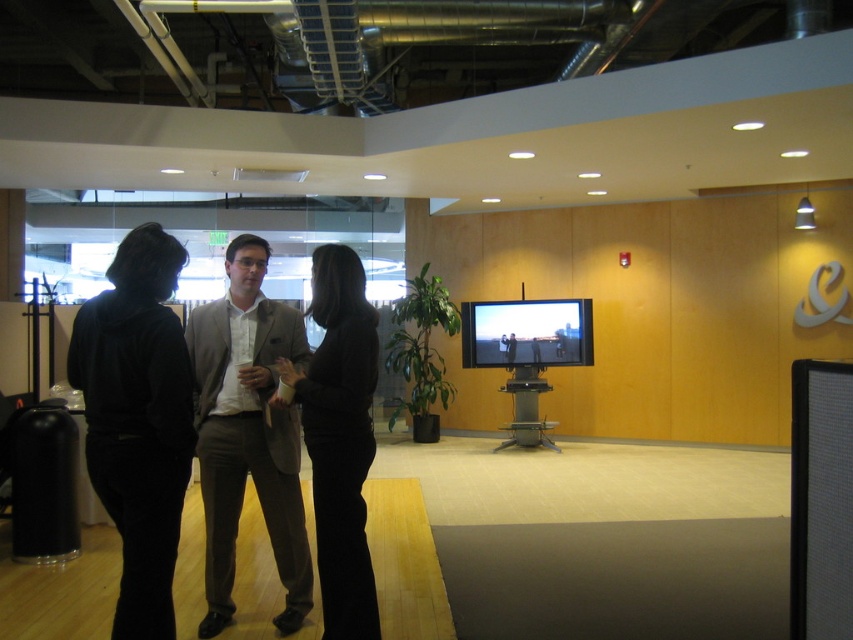
You are an interior designer assessing the layout of this office space. You notice the black matte pants at left and the gray wool suit at center. Based on their positions, which object is higher in the image?

The black matte pants at left is above the gray wool suit at center in the image.

You are an event planner arranging a photoshoot in this office space. You need to place a large backdrop behind the black matte pants at left and the gray wool suit at center. Which object should you position closer to the backdrop to ensure both are framed properly?

The black matte pants at left should be positioned closer to the backdrop because it is on the left side of the gray wool suit at center, so placing it nearer ensures both are framed properly.